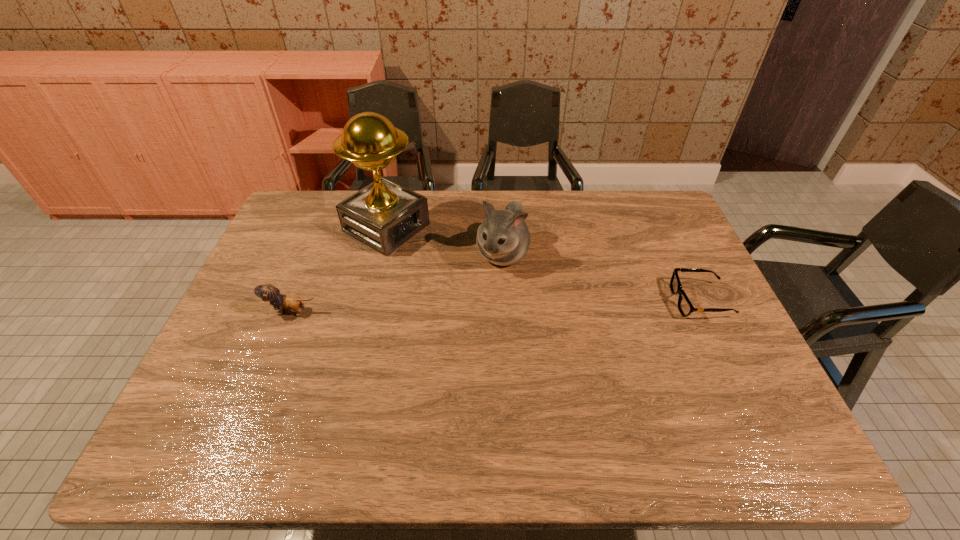
Locate an element on the screen. This screenshot has width=960, height=540. vacant area that lies between the tallest object and the hamster is located at coordinates (444, 241).

At what (x,y) coordinates should I click in order to perform the action: click on free area in between the second shortest object and the tallest object. Please return your answer as a coordinate pair (x, y). Looking at the image, I should click on (340, 269).

Identify the location of empty location between the hamster and the tallest object. The width and height of the screenshot is (960, 540). (444, 241).

You are a GUI agent. You are given a task and a screenshot of the screen. Output one action in this format:
    pyautogui.click(x=<x>, y=<y>)
    Task: Click on the free space between the award and the third tallest object
    This screenshot has height=540, width=960.
    Given the screenshot: What is the action you would take?
    pyautogui.click(x=340, y=269)

Locate an element on the screen. unoccupied area between the third object from left to right and the second shortest object is located at coordinates (397, 283).

Where is `object that can be found as the third closest to the third tallest object`? The width and height of the screenshot is (960, 540). object that can be found as the third closest to the third tallest object is located at coordinates 685,307.

Locate which object is the second closest to the award. Please provide its 2D coordinates. Your answer should be formatted as a tuple, i.e. [(x, y)], where the tuple contains the x and y coordinates of a point satisfying the conditions above.

[(268, 292)]

What are the coordinates of `vacant space that satisfies the following two spatial constraints: 1. on the front side of the shortest object; 2. on the front-facing side of the tallest object` in the screenshot? It's located at (370, 301).

The image size is (960, 540). What are the coordinates of `free location that satisfies the following two spatial constraints: 1. on the front side of the tallest object; 2. on the left side of the second tallest object` in the screenshot? It's located at (380, 254).